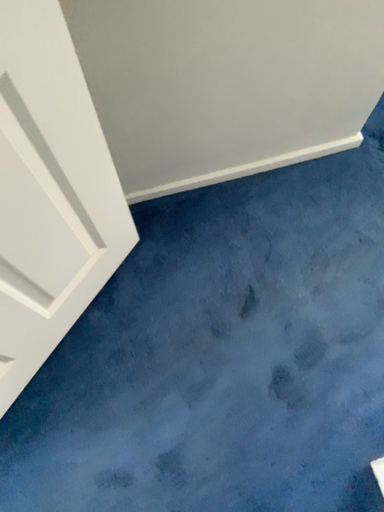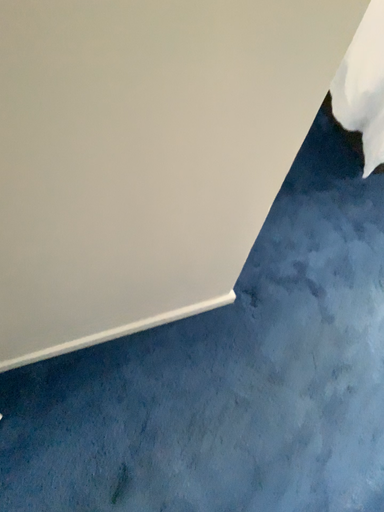
Question: How did the camera likely rotate when shooting the video?

Choices:
 (A) rotated right
 (B) rotated left

Answer: (A)